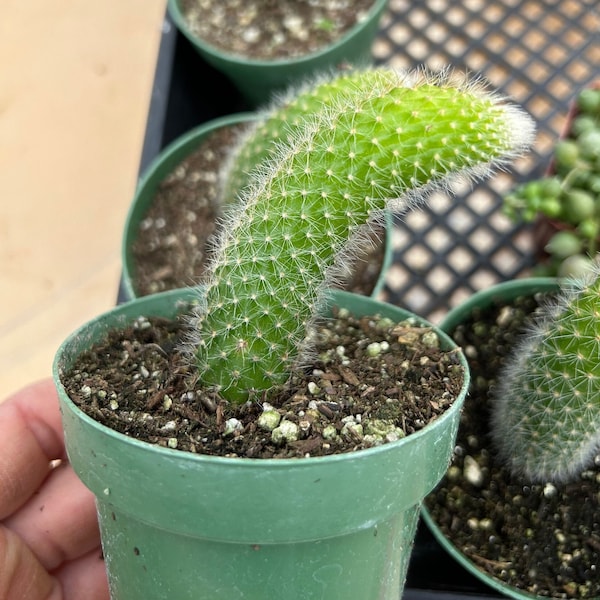
Image resolution: width=600 pixels, height=600 pixels. Identify the location of plant. (291, 124).